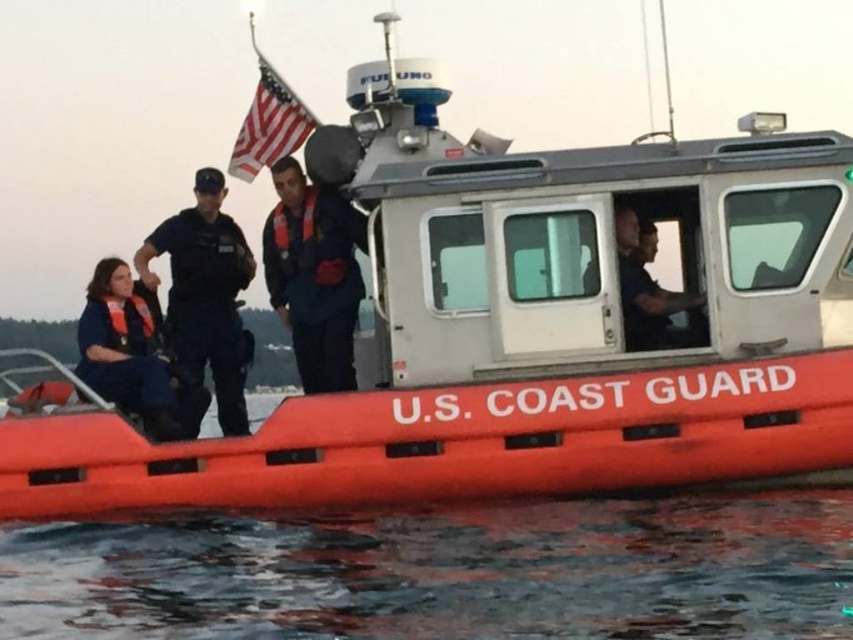
Looking at this image, based on the scene description, which object occupies a larger area in the image? The transparent water at lower center or the matte black uniform at center?

The transparent water at lower center is bigger than the matte black uniform at center.

You are a photographer on the deck of the U.S. Coast Guard boat. You want to take a photo of the transparent water at lower center and the matte black uniform at center. Which object should you focus on first if you want to capture both in the same frame without moving the camera?

The transparent water at lower center is positioned on the right side of matte black uniform at center, so you should focus on the matte black uniform at center first to ensure both are in the frame.